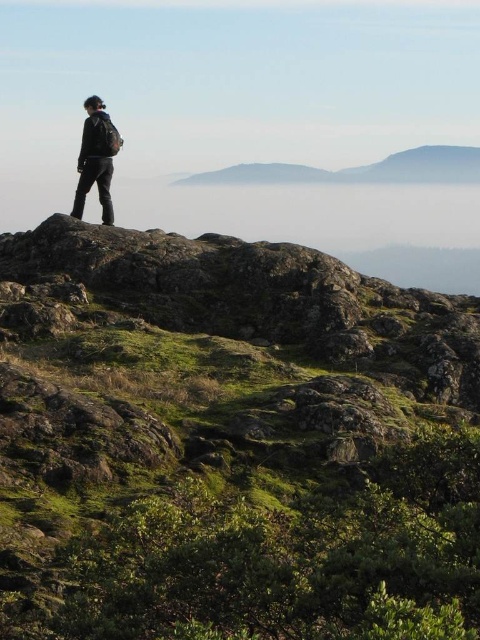
Can you confirm if green mossy rock at upper left is thinner than matte black jacket at center?

No.

Who is shorter, green mossy rock at upper left or matte black jacket at center?

matte black jacket at center

Image resolution: width=480 pixels, height=640 pixels. What do you see at coordinates (230, 442) in the screenshot?
I see `green mossy rock at upper left` at bounding box center [230, 442].

Where is `green mossy rock at upper left`? The width and height of the screenshot is (480, 640). green mossy rock at upper left is located at coordinates pos(230,442).

Can you confirm if green mossy rock at upper left is wider than smooth gray mountain at center?

Incorrect, green mossy rock at upper left's width does not surpass smooth gray mountain at center's.

Is point (106, 333) farther from camera compared to point (429, 156)?

No, (106, 333) is in front of (429, 156).

Find the location of a particular element. The image size is (480, 640). green mossy rock at upper left is located at coordinates (230, 442).

Is smooth gray mountain at center bigger than matte black jacket at center?

Yes, smooth gray mountain at center is bigger than matte black jacket at center.

Can you confirm if smooth gray mountain at center is positioned below matte black jacket at center?

No, smooth gray mountain at center is not below matte black jacket at center.

Who is more forward, (435, 177) or (82, 202)?

Point (82, 202)

You are a GUI agent. You are given a task and a screenshot of the screen. Output one action in this format:
    pyautogui.click(x=<x>, y=<y>)
    Task: Click on the smooth gray mountain at center
    
    Given the screenshot: What is the action you would take?
    pyautogui.click(x=360, y=170)